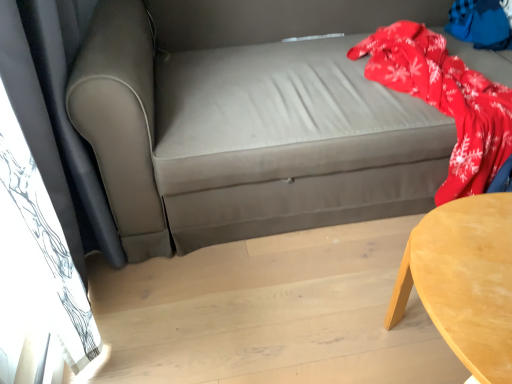
Question: Should I look upward or downward to see light wood table at lower right?

Choices:
 (A) up
 (B) down

Answer: (B)

Question: Is red fleece blanket at upper right located within light wood table at lower right?

Choices:
 (A) yes
 (B) no

Answer: (B)

Question: Is light wood table at lower right not close to red fleece blanket at upper right?

Choices:
 (A) no
 (B) yes

Answer: (B)

Question: Can you confirm if light wood table at lower right is positioned to the right of red fleece blanket at upper right?

Choices:
 (A) yes
 (B) no

Answer: (B)

Question: Is light wood table at lower right oriented towards red fleece blanket at upper right?

Choices:
 (A) yes
 (B) no

Answer: (B)

Question: Is light wood table at lower right facing away from red fleece blanket at upper right?

Choices:
 (A) yes
 (B) no

Answer: (A)

Question: Is light wood table at lower right positioned behind red fleece blanket at upper right?

Choices:
 (A) yes
 (B) no

Answer: (B)

Question: Does red fleece blanket at upper right have a smaller size compared to light wood table at lower right?

Choices:
 (A) yes
 (B) no

Answer: (A)

Question: From the image's perspective, is red fleece blanket at upper right on light wood table at lower right?

Choices:
 (A) no
 (B) yes

Answer: (B)

Question: Is red fleece blanket at upper right facing towards light wood table at lower right?

Choices:
 (A) no
 (B) yes

Answer: (B)

Question: Is red fleece blanket at upper right to the left of light wood table at lower right from the viewer's perspective?

Choices:
 (A) no
 (B) yes

Answer: (A)

Question: Considering the relative positions of red fleece blanket at upper right and light wood table at lower right in the image provided, is red fleece blanket at upper right to the right of light wood table at lower right from the viewer's perspective?

Choices:
 (A) yes
 (B) no

Answer: (A)

Question: Is red fleece blanket at upper right in contact with light wood table at lower right?

Choices:
 (A) yes
 (B) no

Answer: (B)

Question: From the image's perspective, is red fleece blanket at upper right on matte gray couch at center?

Choices:
 (A) no
 (B) yes

Answer: (B)